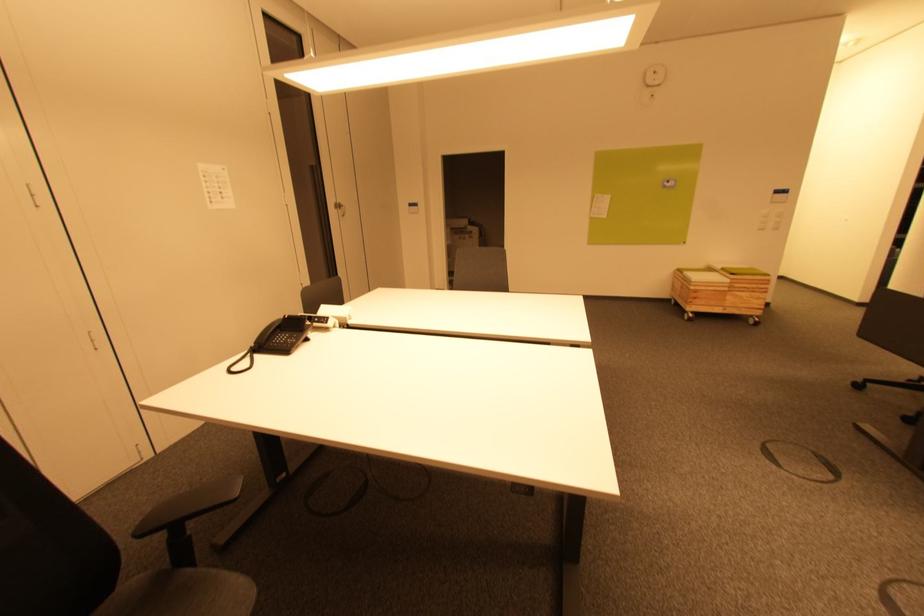
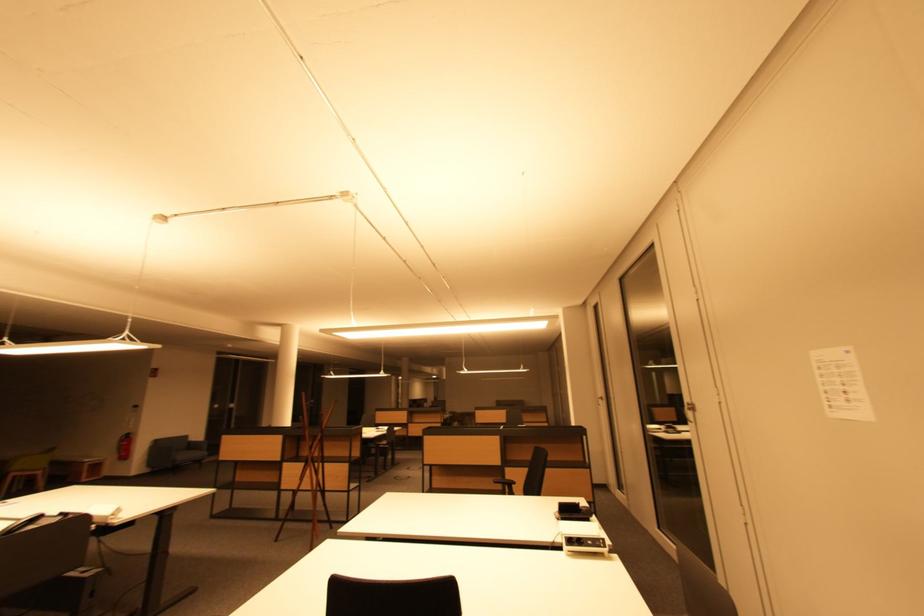
In the second image, find the point that corresponds to the point at 216,204 in the first image.

(834, 408)